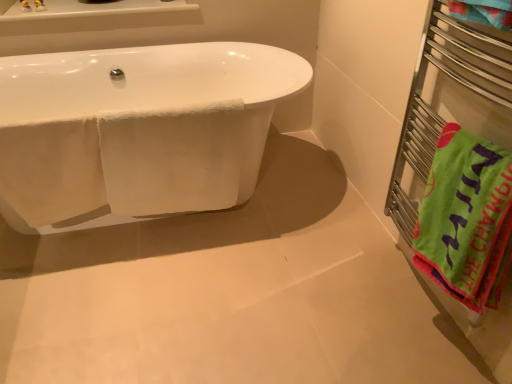
Question: From the image's perspective, relative to white glossy bathtub at left, is white ceramic window sill at upper left above or below?

Choices:
 (A) below
 (B) above

Answer: (B)

Question: Is white ceramic window sill at upper left in front of or behind white glossy bathtub at left in the image?

Choices:
 (A) behind
 (B) front

Answer: (A)

Question: Considering the real-world distances, which object is closest to the white glossy bathtub at left?

Choices:
 (A) green cotton beach towel at right
 (B) metal towel rack at right
 (C) white ceramic window sill at upper left
 (D) white fluffy towel at center

Answer: (D)

Question: Which is farther from the white ceramic window sill at upper left?

Choices:
 (A) white glossy bathtub at left
 (B) white fluffy towel at center
 (C) metal towel rack at right
 (D) green cotton beach towel at right

Answer: (D)